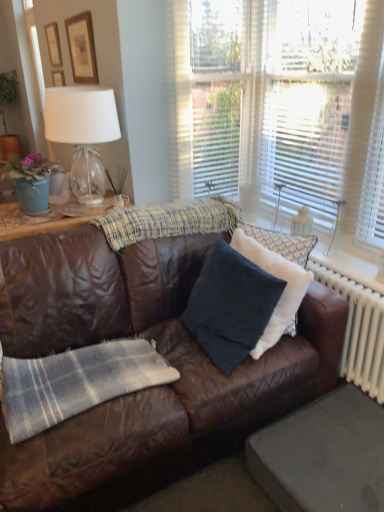
Question: Is white textured curtain at upper right wider or thinner than white plastic radiator at right?

Choices:
 (A) thin
 (B) wide

Answer: (B)

Question: Relative to white plastic radiator at right, is white textured curtain at upper right in front or behind?

Choices:
 (A) behind
 (B) front

Answer: (B)

Question: Which of these objects is positioned farthest from the dark blue suede pillow at center, which appears as the second pillow when viewed from the left?

Choices:
 (A) white blinds at upper center
 (B) white sheer curtain at right
 (C) gray fabric footrest at lower right
 (D) clear glass lampshade at upper left
 (E) wooden picture frame at upper left, the 1th picture frame viewed from the back

Answer: (E)

Question: Which object is the closest to the clear glass lampshade at upper left?

Choices:
 (A) dark blue fabric pillow at center, which is the 1th pillow in left-to-right order
 (B) wooden picture frame at upper left, which appears as the 1th picture frame when viewed from the right
 (C) gray fabric footrest at lower right
 (D) white sheer curtain at right
 (E) dark blue suede pillow at center, which appears as the second pillow when viewed from the left

Answer: (B)